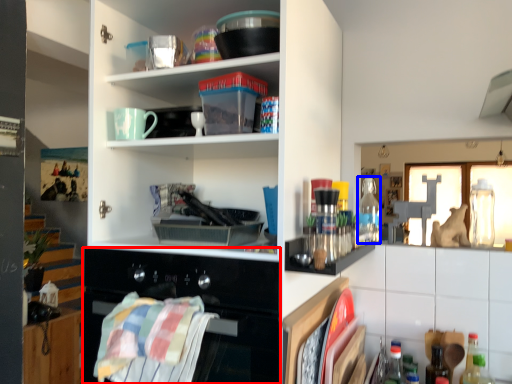
Question: Among these objects, which one is nearest to the camera, oven (highlighted by a red box) or bottle (highlighted by a blue box)?

Choices:
 (A) oven
 (B) bottle

Answer: (A)